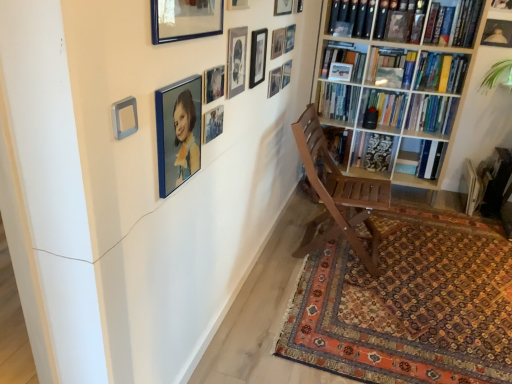
What are the coordinates of `free area below carpeted rug at lower right (from a real-world perspective)` in the screenshot? It's located at (426, 298).